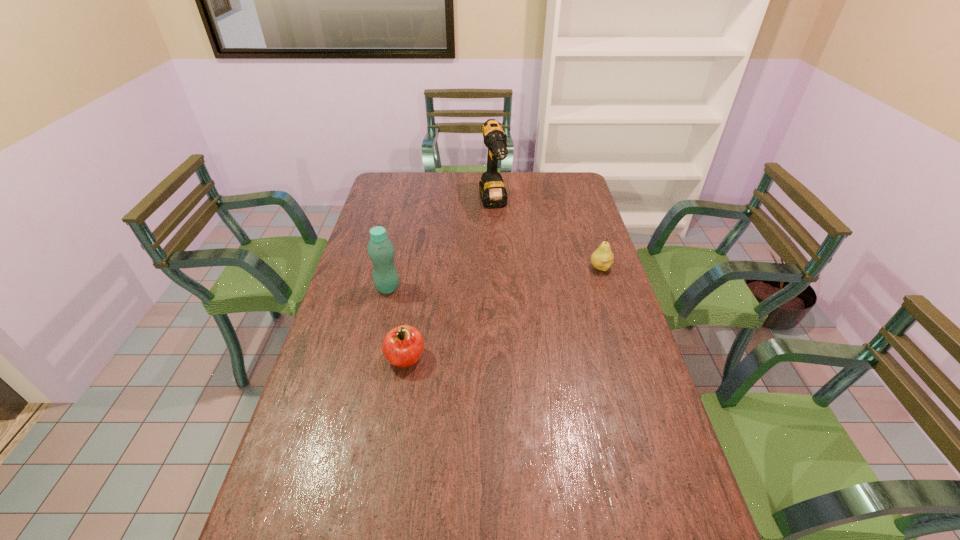
Where is `vacant space situated 0.340m at the front cap of the third farthest object`? vacant space situated 0.340m at the front cap of the third farthest object is located at coordinates (500, 302).

Locate an element on the screen. The height and width of the screenshot is (540, 960). vacant space located at the front cap of the third farthest object is located at coordinates (493, 302).

You are a GUI agent. You are given a task and a screenshot of the screen. Output one action in this format:
    pyautogui.click(x=<x>, y=<y>)
    Task: Click on the vacant area situated at the tip of the drill
    Image resolution: width=960 pixels, height=540 pixels.
    Given the screenshot: What is the action you would take?
    pyautogui.click(x=503, y=240)

Image resolution: width=960 pixels, height=540 pixels. Identify the location of vacant space located 0.340m at the tip of the drill. (517, 276).

The width and height of the screenshot is (960, 540). Find the location of `vacant space located at the tip of the drill`. vacant space located at the tip of the drill is located at coordinates pyautogui.click(x=513, y=264).

You are a GUI agent. You are given a task and a screenshot of the screen. Output one action in this format:
    pyautogui.click(x=<x>, y=<y>)
    Task: Click on the object present at the far edge
    
    Given the screenshot: What is the action you would take?
    pyautogui.click(x=493, y=194)

Find the location of a particular element. object that is at the left edge is located at coordinates (381, 251).

I want to click on object that is at the right edge, so click(x=602, y=258).

Locate an element on the screen. This screenshot has width=960, height=540. vacant space at the far edge of the desktop is located at coordinates (435, 177).

In order to click on vacant area at the near edge of the desktop in this screenshot , I will do `click(388, 529)`.